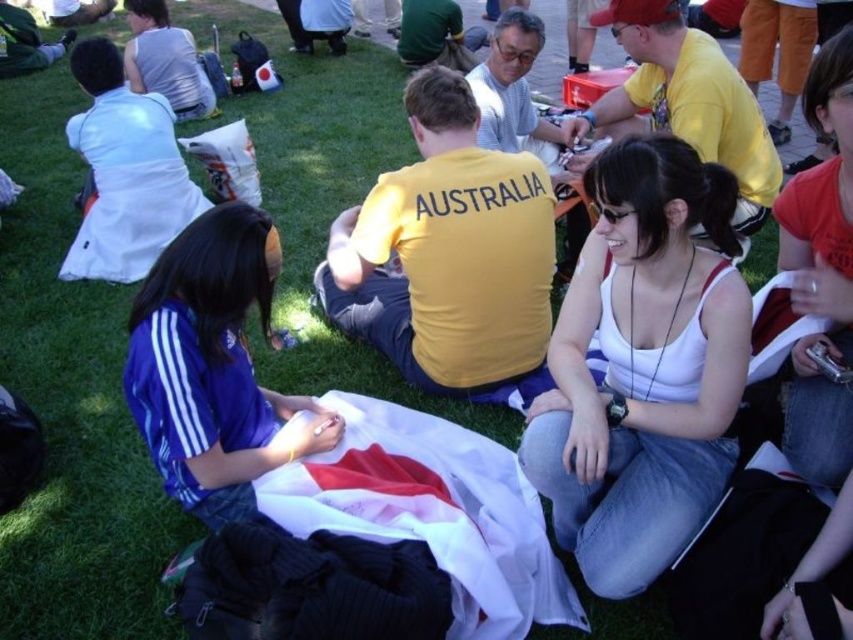
You are standing at the origin of a coordinate system placed at the bottom left corner of the image. You see a point at coordinates [643,368]. What object is located at that point?

The point at coordinates [643,368] corresponds to the white fabric at center.

You are organizing a picnic and need to place a blue jersey at center on top of the white fabric at center. Can you do this based on the scene?

The white fabric at center is currently positioned over the blue jersey at center, so you cannot place the blue jersey at center on top of the white fabric at center as it is already underneath.

You are standing at the point labeled as point (x=213, y=225) and want to throw a ball to the person sitting at point (x=688, y=163). Considering the spatial relationship between these two points, will the ball travel upward or downward towards the target?

The ball will travel downward towards the person at point (x=688, y=163) because that point is closer to the camera, implying it is at a lower elevation compared to point (x=213, y=225).